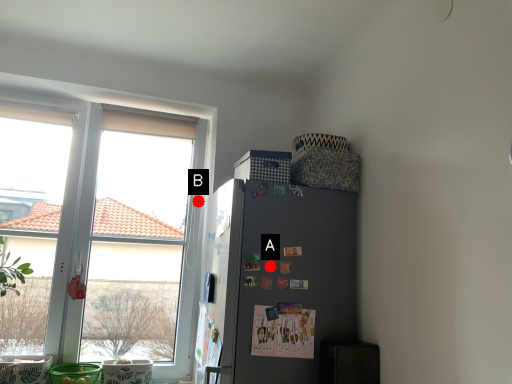
Question: Two points are circled on the image, labeled by A and B beside each circle. Which point is closer to the camera taking this photo?

Choices:
 (A) A is closer
 (B) B is closer

Answer: (A)